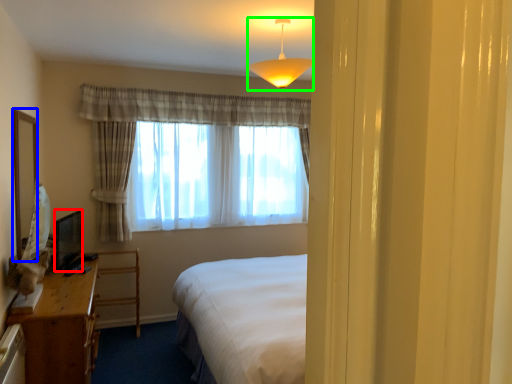
Question: Based on their relative distances, which object is nearer to television (highlighted by a red box)? Choose from mirror (highlighted by a blue box) and lamp (highlighted by a green box).

Choices:
 (A) mirror
 (B) lamp

Answer: (A)